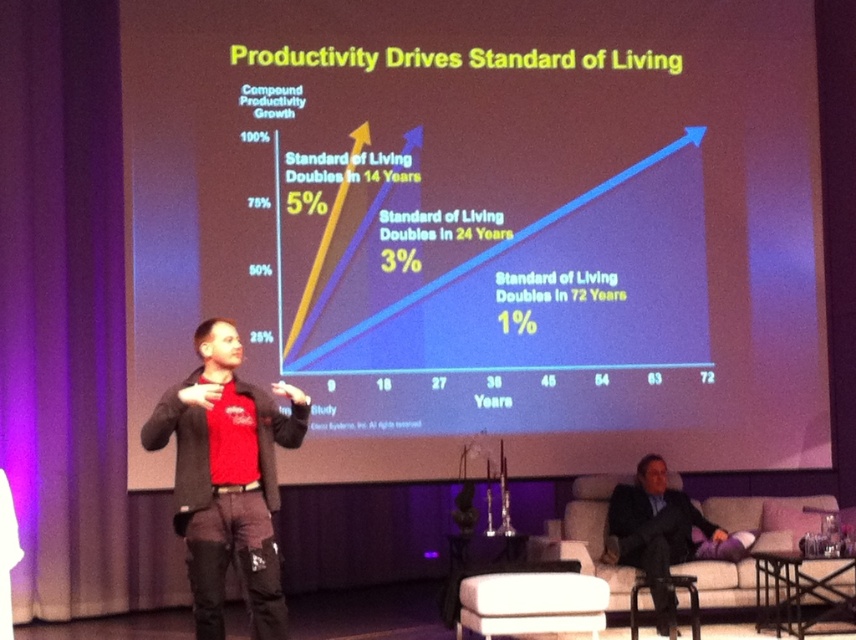
Question: Can you confirm if red cotton shirt at center is positioned above black suit at lower right?

Choices:
 (A) no
 (B) yes

Answer: (B)

Question: Is white matte projection screen at upper center above red cotton shirt at center?

Choices:
 (A) no
 (B) yes

Answer: (B)

Question: Which of the following is the farthest from the observer?

Choices:
 (A) click(x=633, y=481)
 (B) click(x=632, y=26)

Answer: (B)

Question: Can you confirm if white matte projection screen at upper center is positioned below red cotton shirt at center?

Choices:
 (A) no
 (B) yes

Answer: (A)

Question: Which of these objects is positioned farthest from the white matte projection screen at upper center?

Choices:
 (A) black suit at lower right
 (B) red cotton shirt at center

Answer: (B)

Question: Among these points, which one is farthest from the camera?

Choices:
 (A) (642, 236)
 (B) (230, 353)
 (C) (621, 531)

Answer: (A)